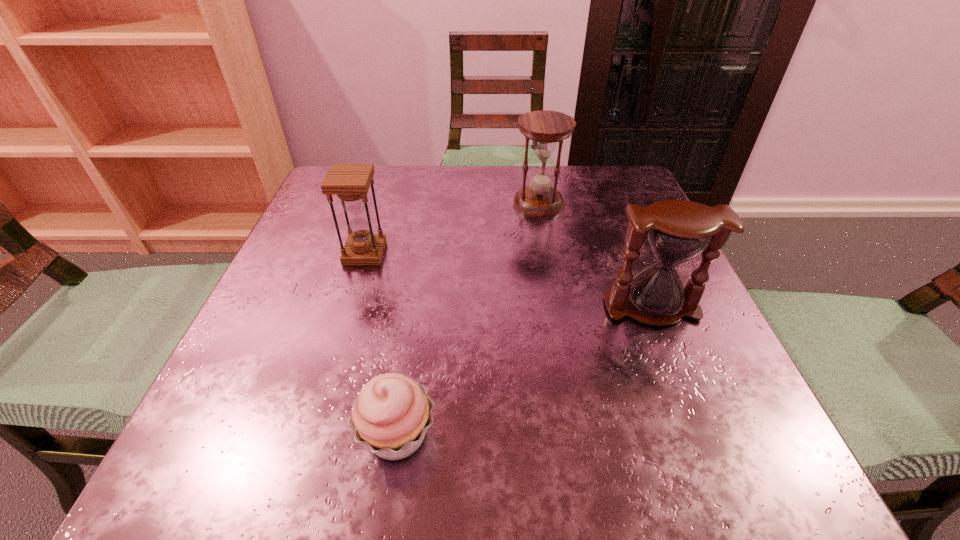
Locate an element on the screen. Image resolution: width=960 pixels, height=540 pixels. free space at the near left corner of the desktop is located at coordinates (282, 449).

In the image, there is a desktop. Where is `free region at the far right corner`? This screenshot has height=540, width=960. free region at the far right corner is located at coordinates (588, 181).

Find the location of a particular element. free space between the cupcake and the second farthest hourglass is located at coordinates (381, 344).

Where is `vacant region between the second hourglass from right to left and the leftmost hourglass`? The height and width of the screenshot is (540, 960). vacant region between the second hourglass from right to left and the leftmost hourglass is located at coordinates (452, 228).

Find the location of a particular element. empty space that is in between the rightmost hourglass and the shortest object is located at coordinates (524, 372).

This screenshot has height=540, width=960. What are the coordinates of `blank region between the second farthest object and the cupcake` in the screenshot? It's located at (381, 344).

Identify the location of unoccupied position between the farthest hourglass and the nearest hourglass. This screenshot has width=960, height=540. (595, 256).

Find the location of a particular element. free spot between the third object from left to right and the second nearest object is located at coordinates (595, 256).

Find the location of a particular element. This screenshot has height=540, width=960. blank region between the nearest hourglass and the leftmost hourglass is located at coordinates (508, 280).

Locate an element on the screen. free spot between the leftmost object and the rightmost object is located at coordinates (508, 280).